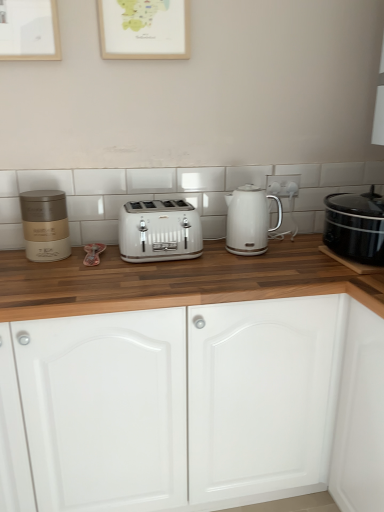
Question: In which direction should I rotate to look at white glossy electric outlet at upper center?

Choices:
 (A) left
 (B) right

Answer: (B)

Question: From the image's perspective, is white glossy cabinet doors at center located beneath white glossy electric kettle at center?

Choices:
 (A) no
 (B) yes

Answer: (B)

Question: Considering the relative sizes of white glossy cabinet doors at center and white glossy electric kettle at center in the image provided, is white glossy cabinet doors at center smaller than white glossy electric kettle at center?

Choices:
 (A) yes
 (B) no

Answer: (B)

Question: Considering the relative positions of white glossy cabinet doors at center and white glossy electric kettle at center in the image provided, is white glossy cabinet doors at center to the right of white glossy electric kettle at center from the viewer's perspective?

Choices:
 (A) no
 (B) yes

Answer: (A)

Question: Is white glossy cabinet doors at center closer to the viewer compared to white glossy electric kettle at center?

Choices:
 (A) yes
 (B) no

Answer: (A)

Question: Does white glossy cabinet doors at center lie behind white glossy electric kettle at center?

Choices:
 (A) yes
 (B) no

Answer: (B)

Question: Considering the relative sizes of white glossy cabinet doors at center and white glossy electric kettle at center in the image provided, is white glossy cabinet doors at center taller than white glossy electric kettle at center?

Choices:
 (A) no
 (B) yes

Answer: (B)

Question: Is wooden picture frame at upper center oriented towards matte gold container at left?

Choices:
 (A) yes
 (B) no

Answer: (B)

Question: Is wooden picture frame at upper center beside matte gold container at left?

Choices:
 (A) yes
 (B) no

Answer: (B)

Question: Considering the relative sizes of wooden picture frame at upper center and matte gold container at left in the image provided, is wooden picture frame at upper center taller than matte gold container at left?

Choices:
 (A) yes
 (B) no

Answer: (A)

Question: Can you confirm if wooden picture frame at upper center is positioned to the right of matte gold container at left?

Choices:
 (A) yes
 (B) no

Answer: (A)

Question: Is wooden picture frame at upper center at the left side of matte gold container at left?

Choices:
 (A) no
 (B) yes

Answer: (A)

Question: From a real-world perspective, is wooden picture frame at upper center on top of matte gold container at left?

Choices:
 (A) yes
 (B) no

Answer: (A)

Question: Can we say white metallic toaster at center lies outside matte gold container at left?

Choices:
 (A) no
 (B) yes

Answer: (B)